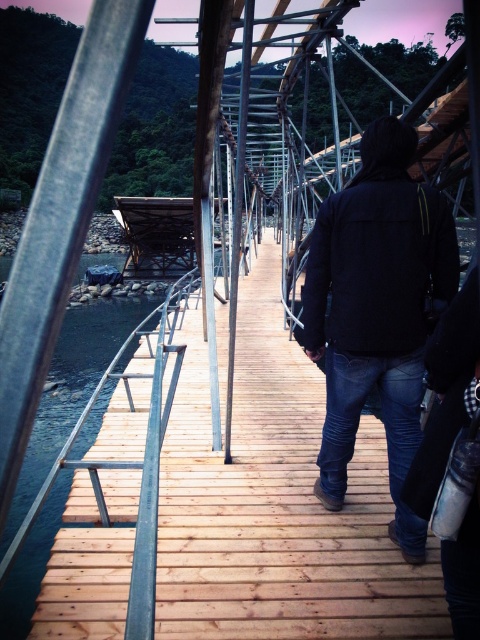
Between dark blue jeans at center and brown wooden river at left, which one appears on the right side from the viewer's perspective?

From the viewer's perspective, dark blue jeans at center appears more on the right side.

Who is more forward, (396,362) or (178,332)?

Point (396,362) is in front.

The height and width of the screenshot is (640, 480). I want to click on dark blue jeans at center, so click(376, 310).